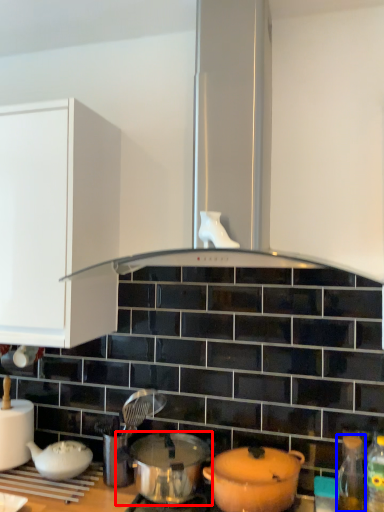
Question: Which object is closer to the camera taking this photo, pot/pan (highlighted by a red box) or bottle (highlighted by a blue box)?

Choices:
 (A) pot/pan
 (B) bottle

Answer: (A)